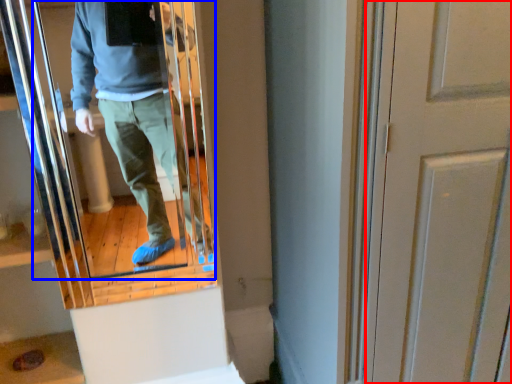
Question: Among these objects, which one is nearest to the camera, door (highlighted by a red box) or mirror (highlighted by a blue box)?

Choices:
 (A) door
 (B) mirror

Answer: (A)